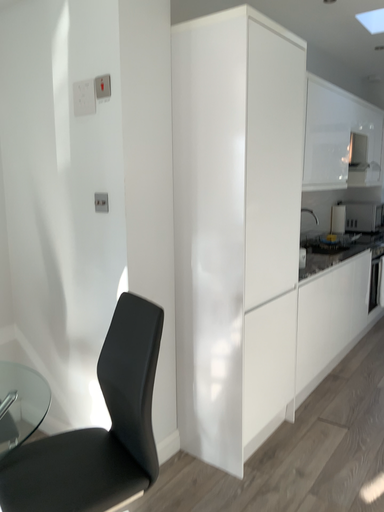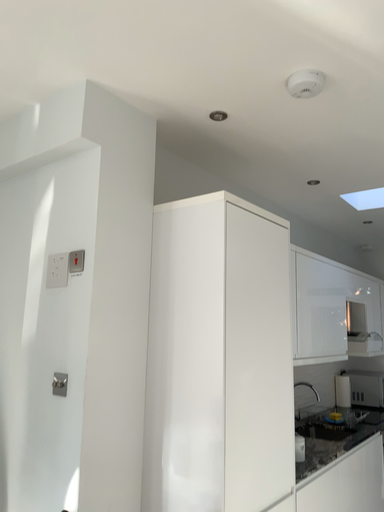
Question: How did the camera likely rotate when shooting the video?

Choices:
 (A) rotated downward
 (B) rotated upward

Answer: (B)